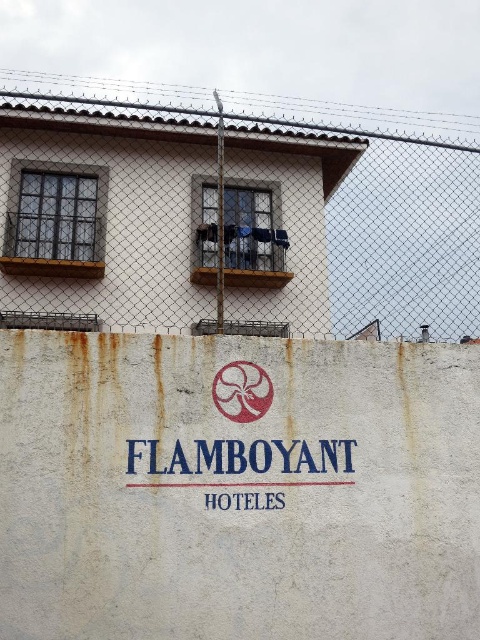
You are standing in front of the building and notice two points marked on the image. The first point is at coordinate point (212, 212) and the second is at point (245, 365). Which point is closer to you?

Point (212, 212) is closer to you because it is further to the viewer than point (245, 365).

You are standing in front of a building and see a red matte flower at center and a white matte sign at center. Which object is closer to you?

The red matte flower at center is closer to you than the white matte sign at center.